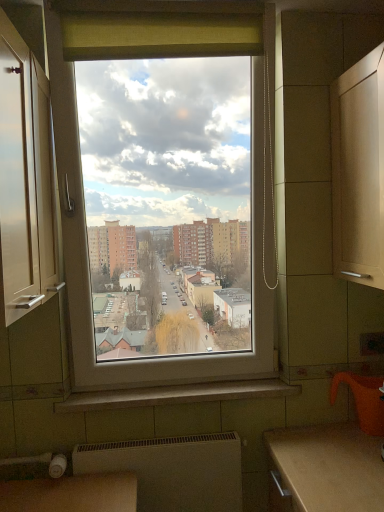
This screenshot has height=512, width=384. In order to click on white glossy cabinet at left in this screenshot , I will do `click(27, 174)`.

In order to click on white glossy window sill at center in this screenshot , I will do `click(176, 395)`.

Is point (166, 401) closer to camera compared to point (151, 439)?

That is True.

Is white glossy window sill at center taller than white matte radiator at lower center?

In fact, white glossy window sill at center may be shorter than white matte radiator at lower center.

This screenshot has width=384, height=512. What are the coordinates of `radiator beneath the white glossy window sill at center (from a real-world perspective)` in the screenshot? It's located at (173, 470).

Is white matte radiator at lower center completely or partially inside white glossy window sill at center?

No, white glossy window sill at center does not contain white matte radiator at lower center.

From the image's perspective, relative to white glossy window sill at center, is white glossy cabinet at left above or below?

Based on their image positions, white glossy cabinet at left is located above white glossy window sill at center.

Is white glossy cabinet at left beside white glossy window sill at center?

white glossy cabinet at left is not next to white glossy window sill at center, and they're not touching.

How far apart are white glossy cabinet at left and white glossy window sill at center?

white glossy cabinet at left and white glossy window sill at center are 31.53 inches apart.

Would you say white glossy cabinet at left contains white glossy window sill at center?

Definitely not — white glossy window sill at center is not inside white glossy cabinet at left.

Can you confirm if white glossy window sill at center is positioned to the left of white glossy cabinet at left?

No.

The height and width of the screenshot is (512, 384). Identify the location of window sill that appears below the white glossy cabinet at left (from a real-world perspective). (176, 395).

Based on the photo, is white glossy window sill at center far away from white glossy cabinet at left?

white glossy window sill at center is near white glossy cabinet at left, not far away.

Does white matte radiator at lower center come behind white glossy window sill at center?

No, it is in front of white glossy window sill at center.

From a real-world perspective, between white matte radiator at lower center and white glossy window sill at center, who is vertically lower?

white matte radiator at lower center is physically lower.

From the picture: From the image's perspective, is white matte radiator at lower center positioned above or below white glossy window sill at center?

Based on their image positions, white matte radiator at lower center is located beneath white glossy window sill at center.

Are white matte radiator at lower center and white glossy window sill at center far apart?

No, white matte radiator at lower center is not far from white glossy window sill at center.

From a real-world perspective, relative to white glossy cabinet at left, is white matte radiator at lower center vertically above or below?

white matte radiator at lower center is below white glossy cabinet at left.

Is white matte radiator at lower center closer to camera compared to white glossy cabinet at left?

No.

Does white matte radiator at lower center appear on the right side of white glossy cabinet at left?

Correct, you'll find white matte radiator at lower center to the right of white glossy cabinet at left.

Is white glossy cabinet at left located within white matte radiator at lower center?

No, white glossy cabinet at left is not inside white matte radiator at lower center.

Can you tell me how much white glossy cabinet at left and white matte radiator at lower center differ in facing direction?

They differ by 90.6 degrees in their facing directions.

Does point (15, 249) come behind point (168, 490)?

No.

Between white glossy cabinet at left and white matte radiator at lower center, which one has smaller size?

white matte radiator at lower center.

Between white glossy cabinet at left and white matte radiator at lower center, which one has smaller width?

Thinner between the two is white matte radiator at lower center.

Identify the location of radiator that is below the white glossy window sill at center (from the image's perspective). The image size is (384, 512). 173,470.

Where is `window sill behind the white glossy cabinet at left`? This screenshot has height=512, width=384. window sill behind the white glossy cabinet at left is located at coordinates (176, 395).

Which object lies further to the anchor point white glossy window sill at center, white glossy cabinet at left or white matte radiator at lower center?

white glossy cabinet at left.

Based on the photo, considering their positions, is white matte radiator at lower center positioned further to white glossy cabinet at left than white glossy window sill at center?

white matte radiator at lower center is further to white glossy cabinet at left.

When comparing their distances from white glossy window sill at center, does white matte radiator at lower center or white glossy cabinet at left seem closer?

Result: Among the two, white matte radiator at lower center is located nearer to white glossy window sill at center.

From the image, which object appears to be farther from white matte radiator at lower center, white glossy window sill at center or white glossy cabinet at left?

white glossy cabinet at left is positioned further to the anchor white matte radiator at lower center.

Based on their spatial positions, is white glossy window sill at center or white matte radiator at lower center further from white glossy cabinet at left?

white matte radiator at lower center.

Considering their positions, is white glossy cabinet at left positioned further to white matte radiator at lower center than white glossy window sill at center?

Based on the image, white glossy cabinet at left appears to be further to white matte radiator at lower center.

This screenshot has height=512, width=384. In order to click on window sill between white glossy cabinet at left and white matte radiator at lower center in the vertical direction in this screenshot , I will do `click(176, 395)`.